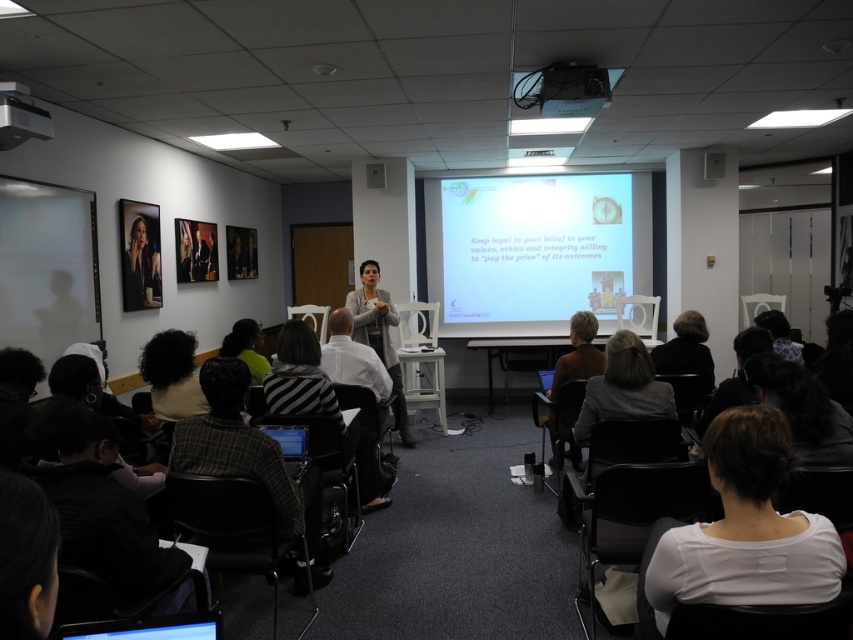
Can you confirm if plaid fabric jacket at lower left is thinner than light gray sweater at center?

Correct, plaid fabric jacket at lower left's width is less than light gray sweater at center's.

Is plaid fabric jacket at lower left closer to camera compared to light gray sweater at center?

Yes, it is.

Is point (223, 387) in front of point (413, 444)?

Yes, it is in front of point (413, 444).

Find the location of a particular element. The height and width of the screenshot is (640, 853). plaid fabric jacket at lower left is located at coordinates (248, 456).

Consider the image. Is plaid fabric jacket at lower left to the right of striped fabric shirt at center from the viewer's perspective?

No, plaid fabric jacket at lower left is not to the right of striped fabric shirt at center.

Is point (184, 451) positioned before point (300, 352)?

Yes, it is.

Where is `plaid fabric jacket at lower left`? Image resolution: width=853 pixels, height=640 pixels. plaid fabric jacket at lower left is located at coordinates (248, 456).

Between point (149, 577) and point (280, 332), which one is positioned behind?

Positioned behind is point (280, 332).

Describe the element at coordinates (97, 502) in the screenshot. I see `black fabric headscarf at lower left` at that location.

Where is `black fabric headscarf at lower left`? black fabric headscarf at lower left is located at coordinates (97, 502).